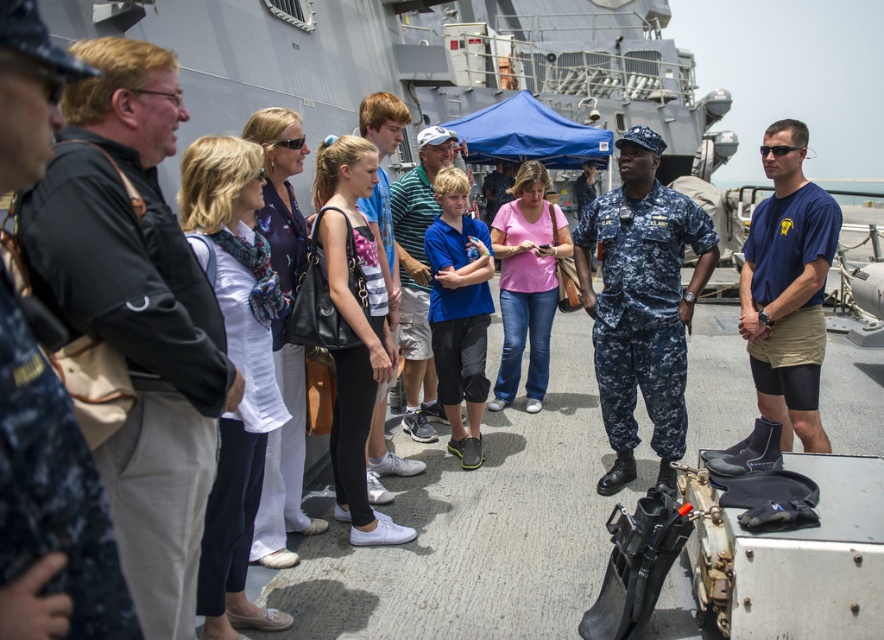
Question: Does dull blue camouflage uniform at center appear on the left side of blue cotton t-shirt at center-right?

Choices:
 (A) no
 (B) yes

Answer: (B)

Question: Does black leather jacket at left appear under dull blue camouflage uniform at center?

Choices:
 (A) no
 (B) yes

Answer: (B)

Question: Which object appears farthest from the camera in this image?

Choices:
 (A) matte blue shirt at center
 (B) blue cotton t-shirt at center-right
 (C) black leather jacket at left
 (D) blue striped shirt at center

Answer: (D)

Question: Can you confirm if black leather jacket at left is bigger than matte blue shirt at center?

Choices:
 (A) no
 (B) yes

Answer: (A)

Question: Which point is farther from the camera taking this photo?

Choices:
 (A) (821, 240)
 (B) (393, 266)

Answer: (B)

Question: Estimate the real-world distances between objects in this image. Which object is farther from the dull blue camouflage uniform at center?

Choices:
 (A) blue striped shirt at center
 (B) black leather jacket at left
 (C) blue cotton t-shirt at center-right

Answer: (B)